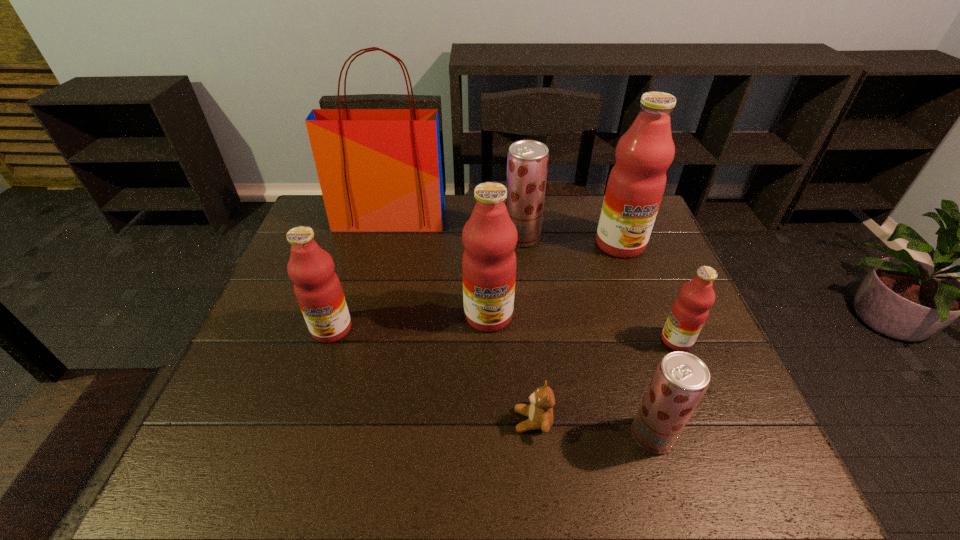
The height and width of the screenshot is (540, 960). In order to click on shopping bag in this screenshot , I will do `click(380, 170)`.

At what (x,y) coordinates should I click in order to perform the action: click on the biggest pink fruit juice. Please return your answer as a coordinate pair (x, y). This screenshot has width=960, height=540. Looking at the image, I should click on (636, 184).

Where is `the farthest pink fruit juice`? This screenshot has height=540, width=960. the farthest pink fruit juice is located at coordinates (636, 184).

What are the coordinates of `the second tallest fruit juice` in the screenshot? It's located at (489, 263).

At what (x,y) coordinates should I click in order to perform the action: click on the second biggest pink fruit juice. Please return your answer as a coordinate pair (x, y). The height and width of the screenshot is (540, 960). Looking at the image, I should click on (489, 263).

Find the location of a particular element. the farther strawberry fruit juice is located at coordinates (527, 162).

Locate an element on the screen. This screenshot has height=540, width=960. the left strawberry fruit juice is located at coordinates (527, 162).

I want to click on the leftmost pink fruit juice, so click(318, 290).

You are a GUI agent. You are given a task and a screenshot of the screen. Output one action in this format:
    pyautogui.click(x=<x>, y=<y>)
    Task: Click on the third biggest pink fruit juice
    This screenshot has height=540, width=960.
    Given the screenshot: What is the action you would take?
    pyautogui.click(x=318, y=290)

Find the location of a particular element. This screenshot has height=540, width=960. the smallest pink fruit juice is located at coordinates (690, 310).